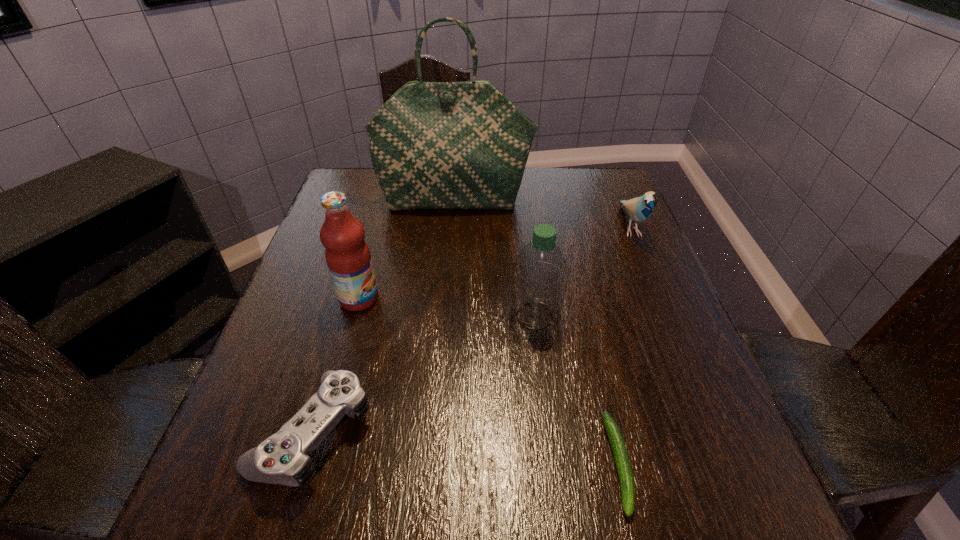
This screenshot has width=960, height=540. I want to click on free space between the control and the tallest object, so click(x=384, y=316).

Find the location of a particular element. vacant region between the tallest object and the bird is located at coordinates (542, 214).

Find the location of a particular element. The image size is (960, 540). vacant space in between the tote bag and the rightmost object is located at coordinates (542, 214).

Locate an element on the screen. The image size is (960, 540). unoccupied area between the water bottle and the tallest object is located at coordinates (494, 259).

Identify the location of unoccupied position between the fifth tallest object and the third shortest object. The image size is (960, 540). (472, 329).

Where is `unoccupied area between the tallest object and the control`? The image size is (960, 540). unoccupied area between the tallest object and the control is located at coordinates (384, 316).

What are the coordinates of `free space between the zucchini and the fruit juice` in the screenshot? It's located at 489,381.

Locate an element on the screen. The width and height of the screenshot is (960, 540). free area in between the tallest object and the water bottle is located at coordinates [494, 259].

Locate which object is the closest to the shortest object. Please provide its 2D coordinates. Your answer should be formatted as a tuple, i.e. [(x, y)], where the tuple contains the x and y coordinates of a point satisfying the conditions above.

[(539, 276)]

Select which object is the second closest to the tote bag. Please provide its 2D coordinates. Your answer should be formatted as a tuple, i.e. [(x, y)], where the tuple contains the x and y coordinates of a point satisfying the conditions above.

[(348, 258)]